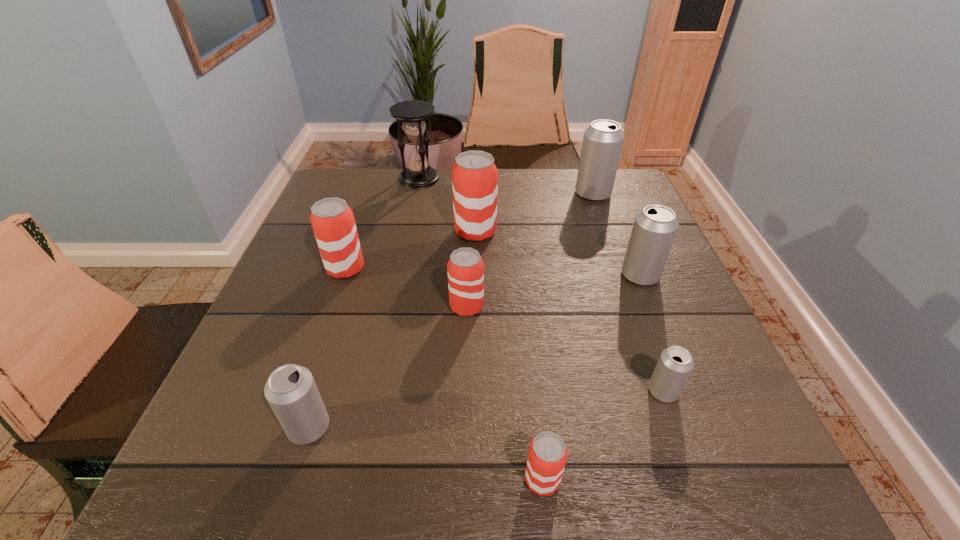
Where is `empty location between the second biggest white beer can and the black hourglass`? The image size is (960, 540). empty location between the second biggest white beer can and the black hourglass is located at coordinates (530, 227).

Find the location of a particular element. free space between the smallest orange beer can and the second smallest orange beer can is located at coordinates (504, 393).

Image resolution: width=960 pixels, height=540 pixels. Find the location of `empty space between the second farthest beer can and the black hourglass`. empty space between the second farthest beer can and the black hourglass is located at coordinates (447, 205).

Where is `vacant area that lies between the second biggest orange beer can and the seventh farthest object`? vacant area that lies between the second biggest orange beer can and the seventh farthest object is located at coordinates (504, 330).

Find the location of `vacant space that's between the farthest beer can and the smallest white beer can`. vacant space that's between the farthest beer can and the smallest white beer can is located at coordinates (628, 293).

Where is `object identified as the fourth closest to the hourglass`? The height and width of the screenshot is (540, 960). object identified as the fourth closest to the hourglass is located at coordinates (465, 269).

You are a GUI agent. You are given a task and a screenshot of the screen. Output one action in this format:
    pyautogui.click(x=<x>, y=<y>)
    Task: Click on the sixth closest object to the second smallest white beer can
    This screenshot has height=540, width=960.
    Given the screenshot: What is the action you would take?
    pyautogui.click(x=654, y=229)

Where is `beer can object that ranks as the seventh closest to the farthest beer can`? beer can object that ranks as the seventh closest to the farthest beer can is located at coordinates (290, 390).

This screenshot has width=960, height=540. In order to click on beer can that stands as the fourth closest to the second nearest object in this screenshot , I will do (474, 175).

This screenshot has height=540, width=960. Find the location of `white beer can that is the closest to the nearest orange beer can`. white beer can that is the closest to the nearest orange beer can is located at coordinates (675, 364).